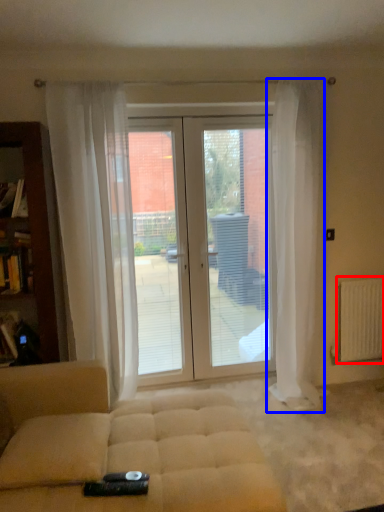
Question: Which object appears closest to the camera in this image, radiator (highlighted by a red box) or curtain (highlighted by a blue box)?

Choices:
 (A) radiator
 (B) curtain

Answer: (B)